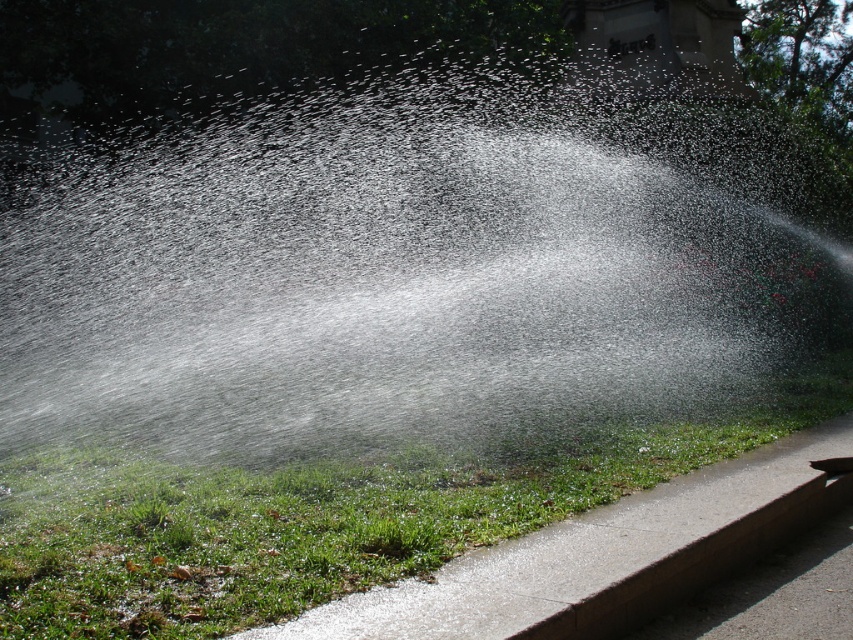
Question: Does transparent water at center lie behind green grass at lower left?

Choices:
 (A) no
 (B) yes

Answer: (B)

Question: Can you confirm if transparent water at center is bigger than green grass at lower left?

Choices:
 (A) yes
 (B) no

Answer: (A)

Question: Can you confirm if transparent water at center is wider than green grass at lower left?

Choices:
 (A) yes
 (B) no

Answer: (A)

Question: Which point appears closest to the camera in this image?

Choices:
 (A) (334, 83)
 (B) (0, 577)

Answer: (B)